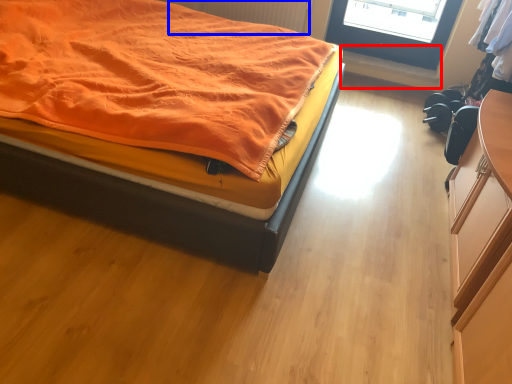
Question: Which point is closer to the camera, window sill (highlighted by a red box) or radiator (highlighted by a blue box)?

Choices:
 (A) window sill
 (B) radiator

Answer: (B)